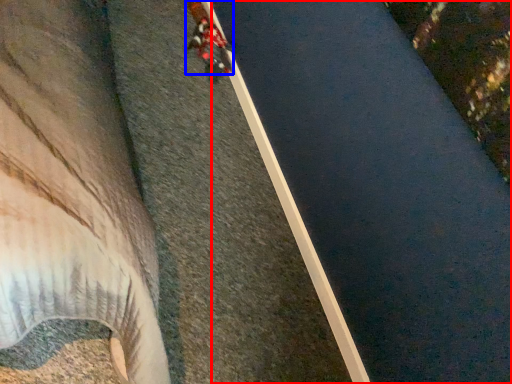
Question: Which point is closer to the camera, waterway (highlighted by a red box) or person (highlighted by a blue box)?

Choices:
 (A) waterway
 (B) person

Answer: (A)